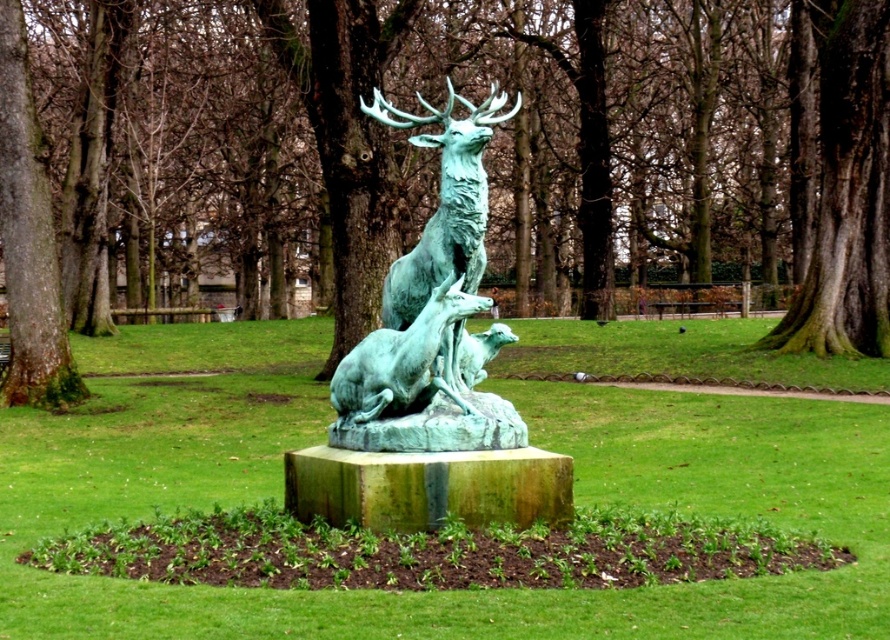
Question: Observing the image, what is the correct spatial positioning of green patina statue at center in reference to green patina bronze deer at center?

Choices:
 (A) right
 (B) left

Answer: (A)

Question: Which object is closer to the camera taking this photo?

Choices:
 (A) green patina statue at center
 (B) green patinated bronze deer at center
 (C) dark brown textured bark at center right
 (D) green patina bronze deer at center

Answer: (A)

Question: Among these objects, which one is farthest from the camera?

Choices:
 (A) dark brown textured bark at center right
 (B) green patinated bronze deer at center

Answer: (A)

Question: Does green patina statue at center appear over dark brown textured bark at center right?

Choices:
 (A) yes
 (B) no

Answer: (A)

Question: Is green mossy tree at center positioned in front of green patina statue at center?

Choices:
 (A) no
 (B) yes

Answer: (A)

Question: Which point appears closest to the camera in this image?

Choices:
 (A) (836, 208)
 (B) (71, 173)
 (C) (406, 378)
 (D) (397, 385)

Answer: (C)